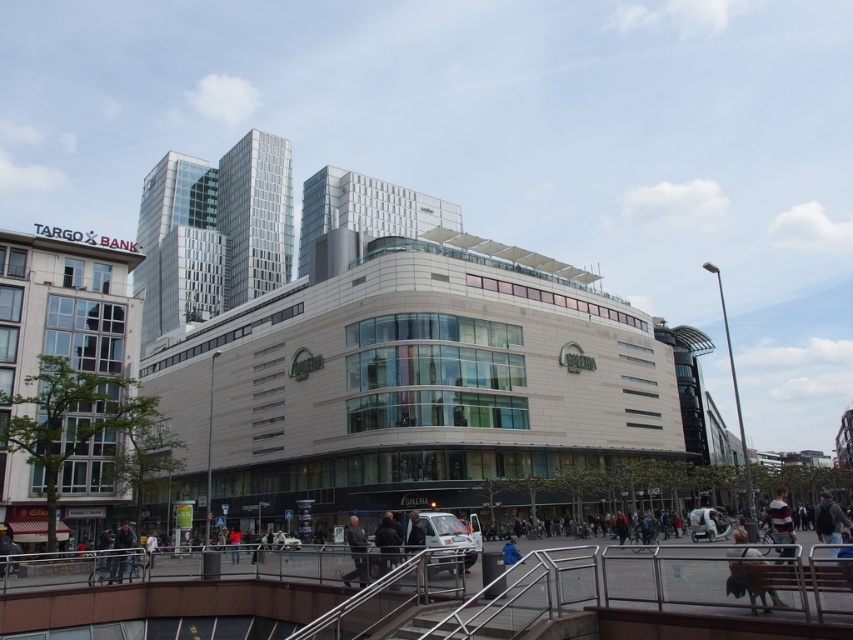
Which is in front, point (740, 548) or point (787, 516)?

Positioned in front is point (740, 548).

Is light brown leather jacket at lower right shorter than striped sweater at lower right?

Correct, light brown leather jacket at lower right is not as tall as striped sweater at lower right.

What do you see at coordinates (747, 586) in the screenshot? The width and height of the screenshot is (853, 640). I see `light brown leather jacket at lower right` at bounding box center [747, 586].

At what (x,y) coordinates should I click in order to perform the action: click on light brown leather jacket at lower right. Please return your answer as a coordinate pair (x, y). Image resolution: width=853 pixels, height=640 pixels. Looking at the image, I should click on (747, 586).

Does dark gray backpack at lower right appear under striped sweater at lower right?

Indeed, dark gray backpack at lower right is positioned under striped sweater at lower right.

In the scene shown: How distant is dark gray backpack at lower right from striped sweater at lower right?

dark gray backpack at lower right and striped sweater at lower right are 3.67 meters apart from each other.

Who is more forward, (833, 515) or (788, 554)?

Positioned in front is point (788, 554).

At what (x,y) coordinates should I click in order to perform the action: click on dark gray backpack at lower right. Please return your answer as a coordinate pair (x, y). Image resolution: width=853 pixels, height=640 pixels. Looking at the image, I should click on (828, 518).

Who is lower down, dark gray backpack at lower right or blue fabric jacket at lower center?

blue fabric jacket at lower center is lower down.

Looking at this image, between dark gray backpack at lower right and blue fabric jacket at lower center, which one has more height?

Standing taller between the two is dark gray backpack at lower right.

The image size is (853, 640). Find the location of `dark gray backpack at lower right`. dark gray backpack at lower right is located at coordinates coord(828,518).

Where is `dark gray backpack at lower right`? dark gray backpack at lower right is located at coordinates (828, 518).